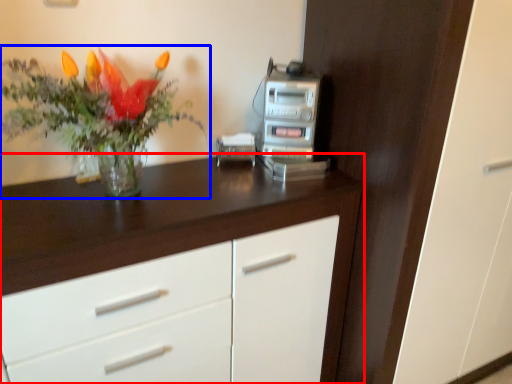
Question: Which point is further to the camera, chest of drawers (highlighted by a red box) or houseplant (highlighted by a blue box)?

Choices:
 (A) chest of drawers
 (B) houseplant

Answer: (A)